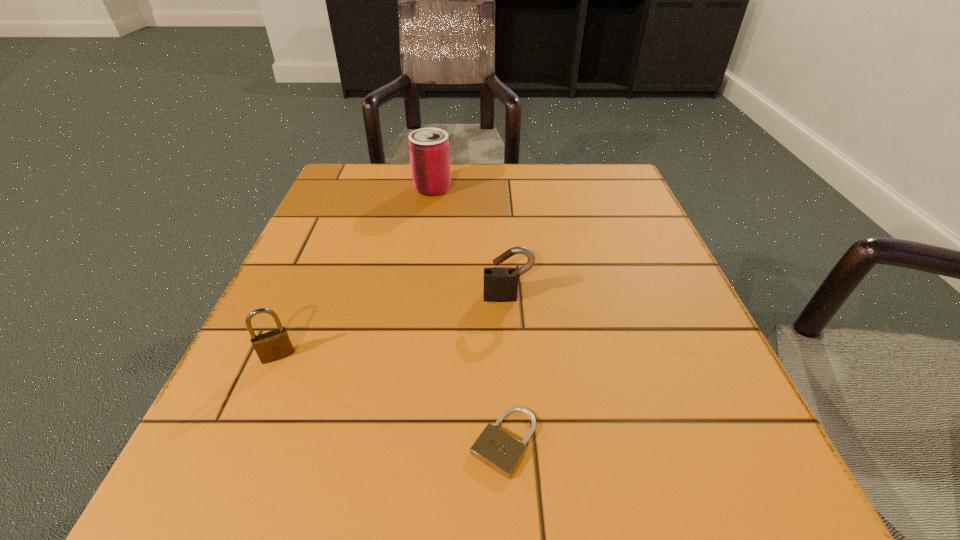
Identify the location of the farthest object. Image resolution: width=960 pixels, height=540 pixels. (429, 148).

The height and width of the screenshot is (540, 960). I want to click on the tallest object, so click(429, 148).

Find the location of a particular element. This screenshot has width=960, height=540. the second farthest object is located at coordinates (502, 282).

You are a GUI agent. You are given a task and a screenshot of the screen. Output one action in this format:
    pyautogui.click(x=<x>, y=<y>)
    Task: Click on the second nearest object
    The width and height of the screenshot is (960, 540).
    Given the screenshot: What is the action you would take?
    pyautogui.click(x=274, y=345)

Identify the location of the leftmost object. The image size is (960, 540). (274, 345).

Identify the location of the nearest object. (495, 448).

The image size is (960, 540). Identify the location of the shortest padlock. (495, 448).

Find the location of a particular element. This screenshot has width=960, height=540. vacant space located on the right of the can is located at coordinates (473, 188).

You are a GUI agent. You are given a task and a screenshot of the screen. Output one action in this format:
    pyautogui.click(x=<x>, y=<y>)
    Task: Click on the free location located 0.060m with the keyhole on the front of the farthest padlock
    
    Given the screenshot: What is the action you would take?
    pyautogui.click(x=510, y=329)

Locate an element on the screen. vacant space located 0.080m on the back of the leftmost padlock is located at coordinates (298, 310).